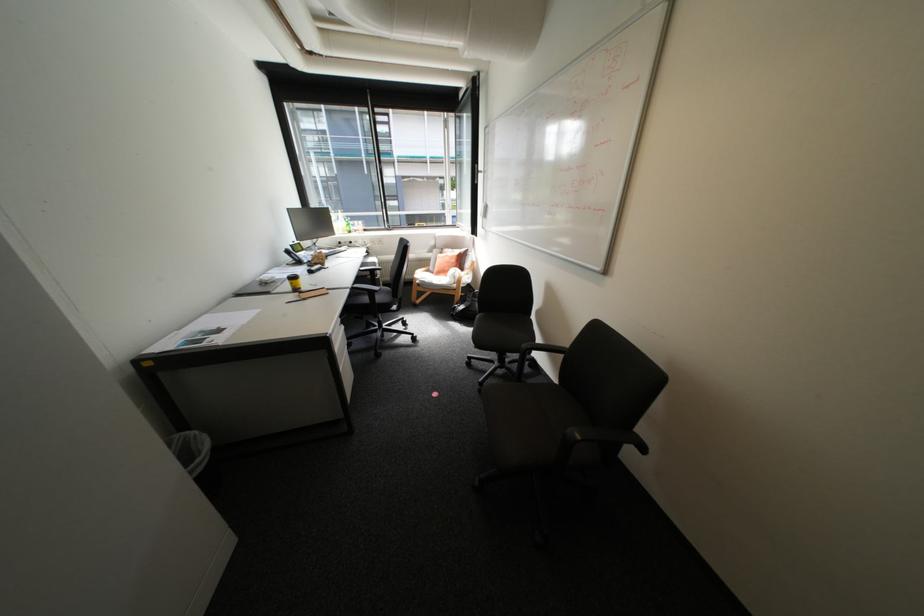
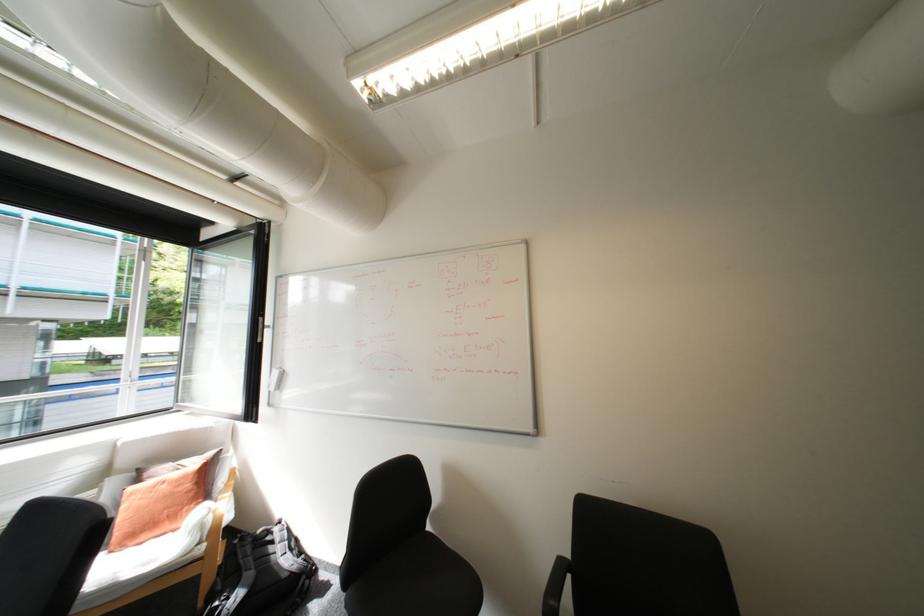
Find the pixel in the second image that matches pixel 468 306 in the first image.

(238, 599)